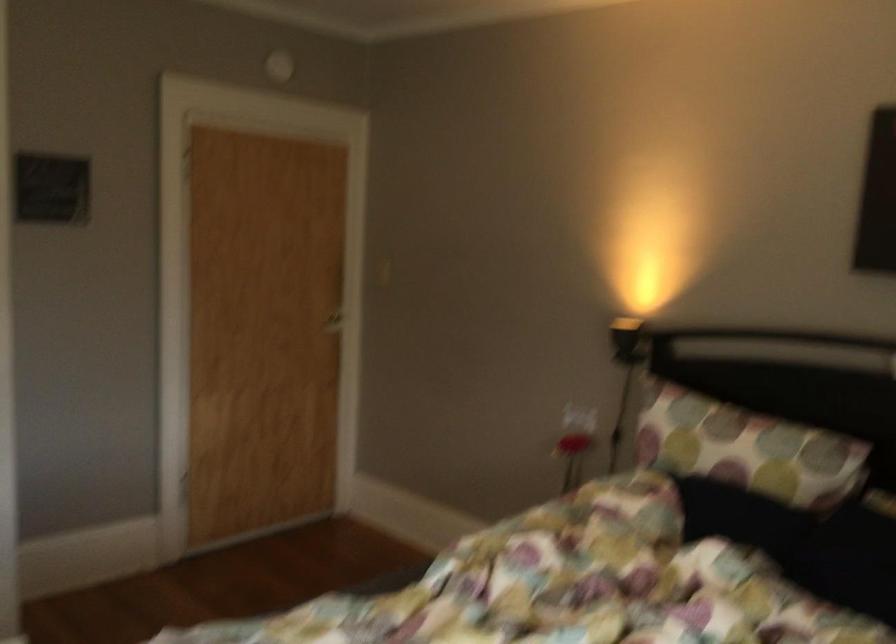
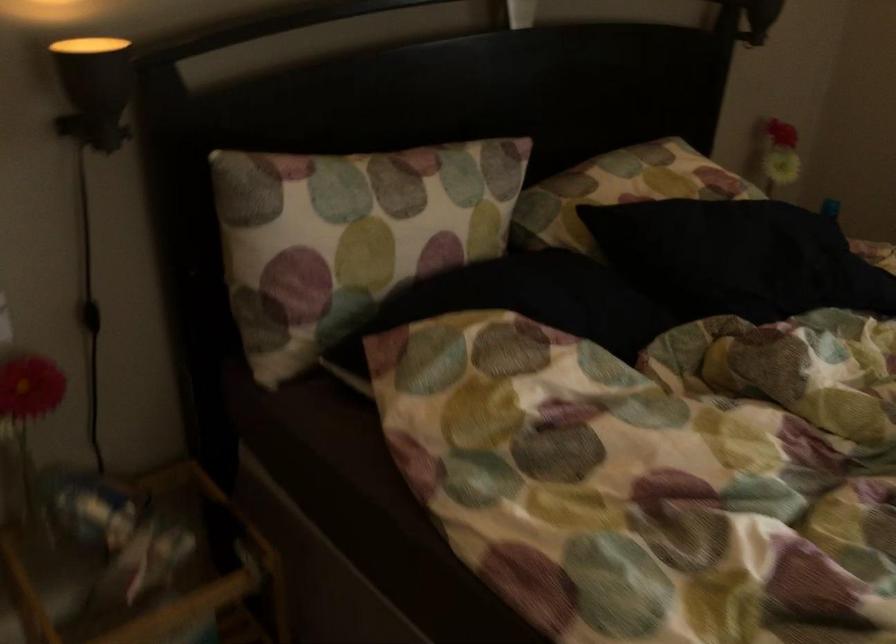
Where in the second image is the point corresponding to (x=699, y=424) from the first image?

(367, 207)